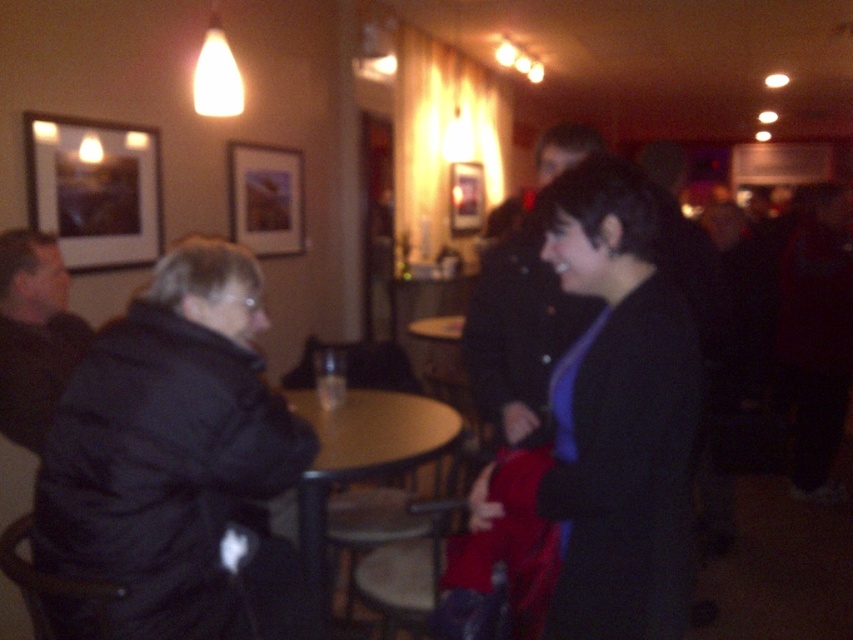
Question: In this image, where is wooden round table at center located relative to translucent glass bottle at center?

Choices:
 (A) above
 (B) below

Answer: (B)

Question: Does dark blue jacket at center appear over dark gray jacket at left?

Choices:
 (A) no
 (B) yes

Answer: (B)

Question: Is the position of matte black picture frame at upper left less distant than that of wooden framed picture at upper center?

Choices:
 (A) yes
 (B) no

Answer: (A)

Question: Estimate the real-world distances between objects in this image. Which object is closer to the wooden round table at center?

Choices:
 (A) matte black picture frame at upper left
 (B) dark blue jacket at center
 (C) matte black coat at center

Answer: (B)

Question: Which object appears closest to the camera in this image?

Choices:
 (A) matte black picture frame at upper left
 (B) translucent glass bottle at center
 (C) dark gray jacket at left
 (D) dark blue jacket at center

Answer: (D)

Question: Which of the following is the closest to the observer?

Choices:
 (A) (477, 308)
 (B) (320, 524)

Answer: (A)